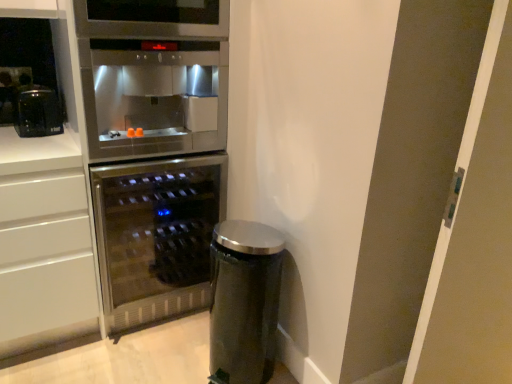
Question: From the image's perspective, is satin silver trash can at lower right positioned above or below matte black coffee maker at upper left?

Choices:
 (A) below
 (B) above

Answer: (A)

Question: From their relative heights in the image, would you say satin silver trash can at lower right is taller or shorter than matte black coffee maker at upper left?

Choices:
 (A) short
 (B) tall

Answer: (B)

Question: Which object is positioned farthest from the stainless steel oven at upper center?

Choices:
 (A) satin silver trash can at lower right
 (B) stainless steel fridge at center
 (C) transparent glass door at right
 (D) matte black coffee maker at upper left
 (E) stainless steel wine cooler at center

Answer: (C)

Question: Which object is the closest to the transparent glass door at right?

Choices:
 (A) stainless steel oven at upper center
 (B) stainless steel fridge at center
 (C) satin silver trash can at lower right
 (D) stainless steel wine cooler at center
 (E) matte black coffee maker at upper left

Answer: (C)